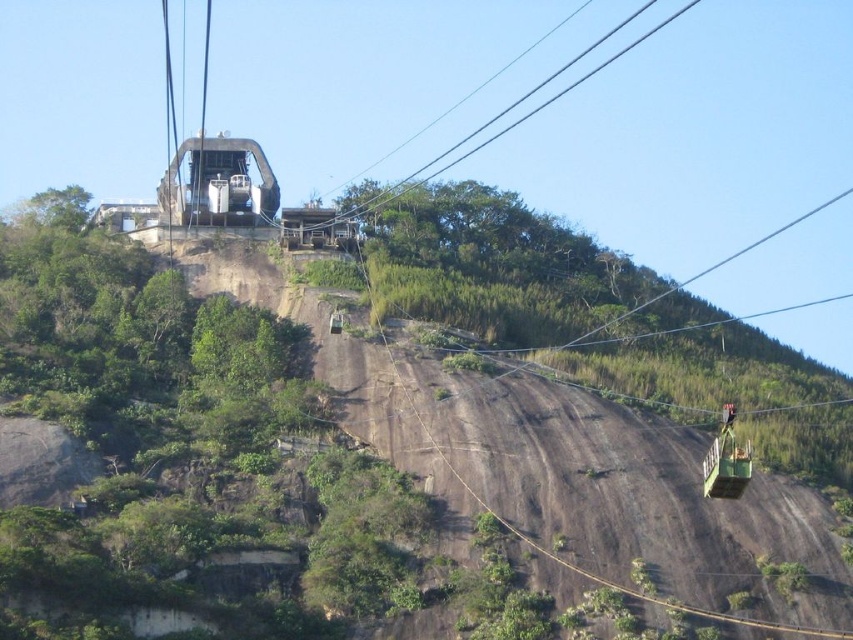
Can you confirm if green metallic cable car at right is smaller than metallic gray cable car at upper center?

No.

Does point (705, 465) come farther from viewer compared to point (209, 198)?

No, (705, 465) is in front of (209, 198).

You are a GUI agent. You are given a task and a screenshot of the screen. Output one action in this format:
    pyautogui.click(x=<x>, y=<y>)
    Task: Click on the green metallic cable car at right
    The width and height of the screenshot is (853, 640).
    Given the screenshot: What is the action you would take?
    [726, 460]